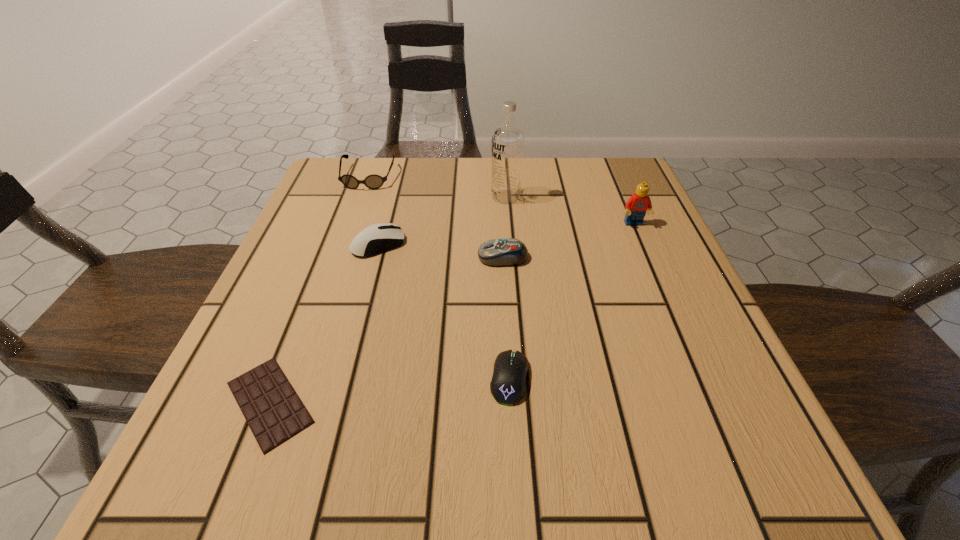
The height and width of the screenshot is (540, 960). I want to click on the tallest object, so click(507, 150).

At what (x,y) coordinates should I click in order to perform the action: click on the third farthest object. Please return your answer as a coordinate pair (x, y). Image resolution: width=960 pixels, height=540 pixels. Looking at the image, I should click on (636, 206).

Identify the location of Lego. (636, 206).

Find the location of a particular element. sunglasses is located at coordinates (373, 181).

Where is `the leftmost computer equipment`? Image resolution: width=960 pixels, height=540 pixels. the leftmost computer equipment is located at coordinates (380, 237).

You are a GUI agent. You are given a task and a screenshot of the screen. Output one action in this format:
    pyautogui.click(x=<x>, y=<y>)
    Task: Click on the shortest computer equipment
    
    Given the screenshot: What is the action you would take?
    pyautogui.click(x=507, y=386)

Identify the location of the nearest computer equipment. (507, 386).

At what (x,y) coordinates should I click in order to perform the action: click on the shortest object. Please return your answer as a coordinate pair (x, y). This screenshot has width=960, height=540. Looking at the image, I should click on (273, 410).

Locate an element on the screen. The height and width of the screenshot is (540, 960). free space located 0.110m on the front label of the vodka is located at coordinates (444, 197).

Find the location of a particular element. vacant space located 0.300m on the front label of the vodka is located at coordinates [x=363, y=197].